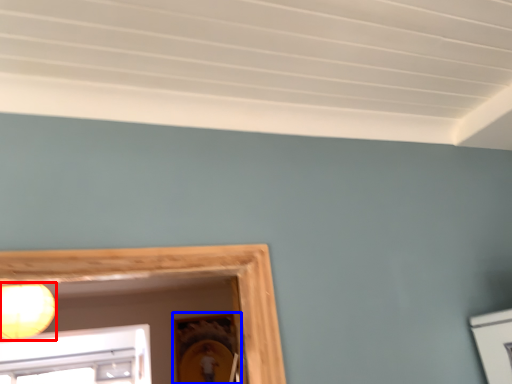
Question: Which object is closer to the camera taking this photo, lamp (highlighted by a red box) or picture frame (highlighted by a blue box)?

Choices:
 (A) lamp
 (B) picture frame

Answer: (A)